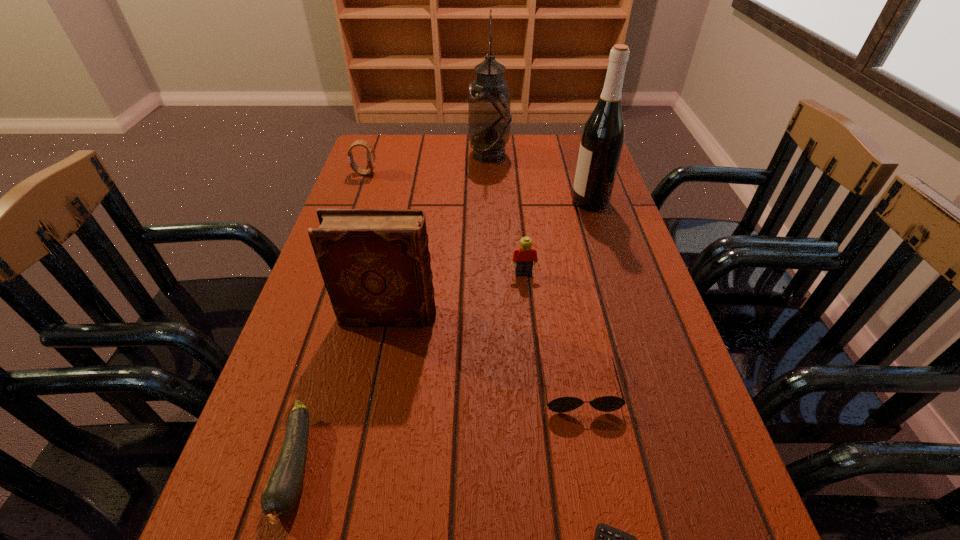
Locate an element on the screen. watch positioned at the left edge is located at coordinates (370, 155).

Locate an element on the screen. This screenshot has width=960, height=540. zucchini located at the left edge is located at coordinates (283, 488).

Identify the location of wine bottle that is at the right edge. (602, 140).

What are the coordinates of `sunglasses located in the right edge section of the desktop` in the screenshot? It's located at (606, 403).

Locate an element on the screen. Image resolution: width=960 pixels, height=540 pixels. object present at the far left corner is located at coordinates (370, 155).

Identify the location of vacant space at the far edge of the desktop. (446, 160).

Image resolution: width=960 pixels, height=540 pixels. I want to click on free space at the left edge of the desktop, so click(x=329, y=318).

In the image, there is a desktop. Where is `vacant region at the right edge`? vacant region at the right edge is located at coordinates (644, 442).

This screenshot has height=540, width=960. Identify the location of vacant position at the far right corner of the desktop. (577, 134).

Where is `vacant space that is in between the oil lamp and the wine bottle`? The height and width of the screenshot is (540, 960). vacant space that is in between the oil lamp and the wine bottle is located at coordinates (540, 178).